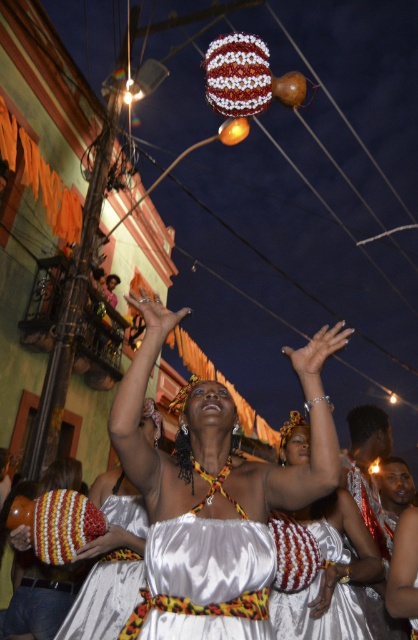
Based on the scene description, where is the satin white dress at center located in terms of its 2D coordinates?

The satin white dress at center is located at the 2D coordinates point (x=214, y=496).

You are standing in the middle of the street looking at the festive decorations. There are two points marked on the buildings. Which point, point (193, 401) or point (106, 602), is closer to you?

Point (193, 401) is closer to the viewer than point (106, 602).